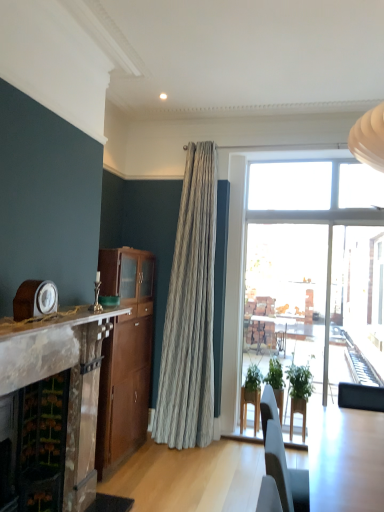
Question: Does wooden cabinet at center have a smaller size compared to green matte plant at center, which ranks as the first houseplant in left-to-right order?

Choices:
 (A) no
 (B) yes

Answer: (A)

Question: From a real-world perspective, is wooden cabinet at center physically below green matte plant at center, which ranks as the first houseplant in left-to-right order?

Choices:
 (A) yes
 (B) no

Answer: (B)

Question: Is wooden cabinet at center shorter than green matte plant at center, which is the second houseplant in right-to-left order?

Choices:
 (A) yes
 (B) no

Answer: (B)

Question: Is wooden cabinet at center outside of green matte plant at center, which is the second houseplant in right-to-left order?

Choices:
 (A) no
 (B) yes

Answer: (B)

Question: Is wooden cabinet at center further to camera compared to green matte plant at center, which is the second houseplant in right-to-left order?

Choices:
 (A) yes
 (B) no

Answer: (B)

Question: Considering the positions of marble fireplace at left and wooden clock at left in the image, is marble fireplace at left bigger or smaller than wooden clock at left?

Choices:
 (A) big
 (B) small

Answer: (A)

Question: Considering their positions, is marble fireplace at left located in front of or behind wooden clock at left?

Choices:
 (A) front
 (B) behind

Answer: (A)

Question: From the image's perspective, relative to wooden clock at left, is marble fireplace at left above or below?

Choices:
 (A) above
 (B) below

Answer: (B)

Question: Considering the positions of marble fireplace at left and wooden clock at left in the image, is marble fireplace at left taller or shorter than wooden clock at left?

Choices:
 (A) tall
 (B) short

Answer: (A)

Question: In the image, is light wood table at lower right positioned in front of or behind marble mantel at left?

Choices:
 (A) behind
 (B) front

Answer: (B)

Question: From the image's perspective, is light wood table at lower right above or below marble mantel at left?

Choices:
 (A) above
 (B) below

Answer: (B)

Question: Is light wood table at lower right wider or thinner than marble mantel at left?

Choices:
 (A) thin
 (B) wide

Answer: (B)

Question: Is point (314, 465) positioned closer to the camera than point (23, 322)?

Choices:
 (A) farther
 (B) closer

Answer: (A)

Question: Based on their positions, is green matte plant at center, which ranks as the first houseplant in left-to-right order, located to the left or right of marble fireplace at left?

Choices:
 (A) left
 (B) right

Answer: (B)

Question: Is point (243, 416) positioned closer to the camera than point (100, 323)?

Choices:
 (A) farther
 (B) closer

Answer: (A)